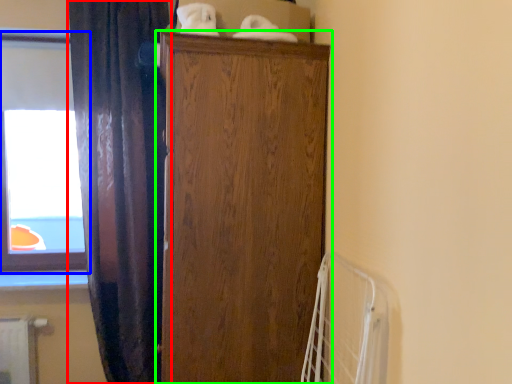
Question: Which object is positioned farthest from curtain (highlighted by a red box)? Select from window (highlighted by a blue box) and cupboard (highlighted by a green box).

Choices:
 (A) window
 (B) cupboard

Answer: (B)